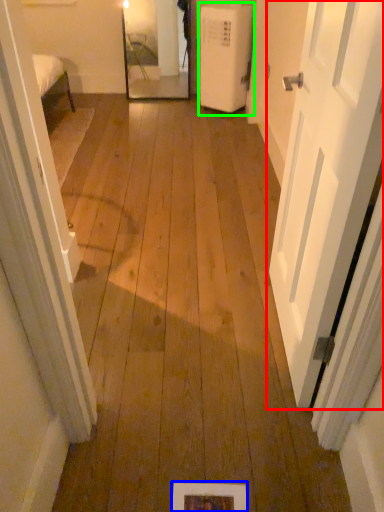
Question: Based on their relative distances, which object is farther from door (highlighted by a red box)? Choose from picture frame (highlighted by a blue box) and air conditioner (highlighted by a green box).

Choices:
 (A) picture frame
 (B) air conditioner

Answer: (B)